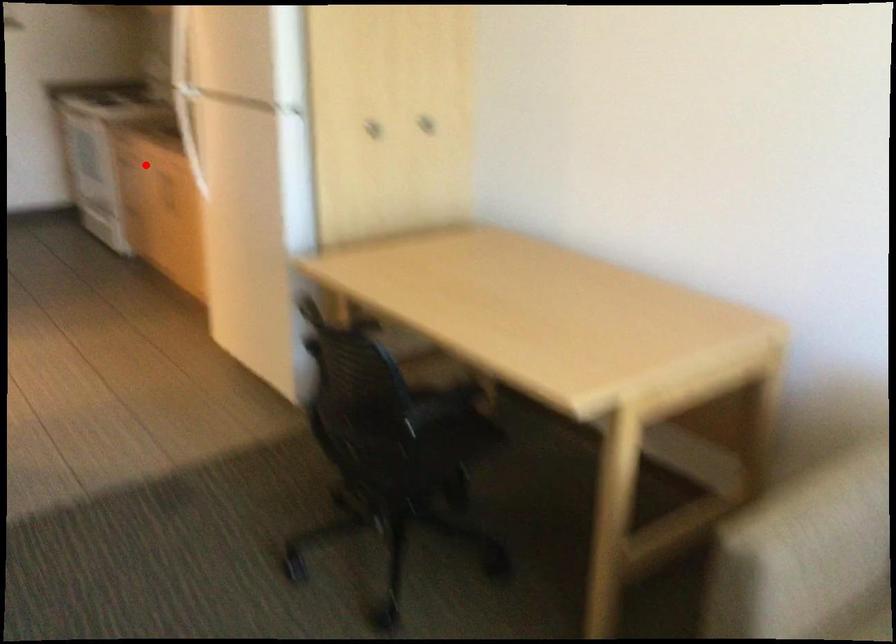
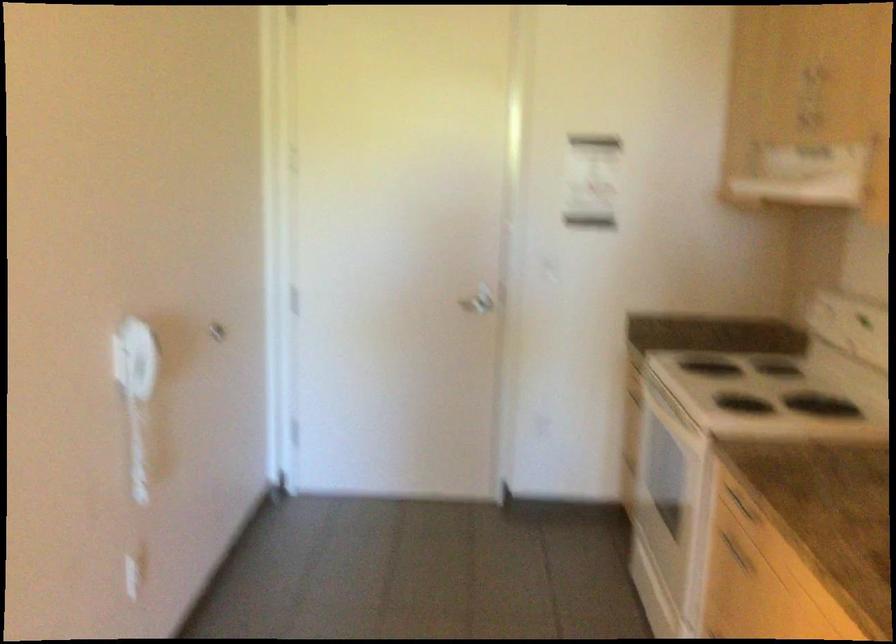
Question: I am providing you with two images of the same scene from different viewpoints. In image1, a red point is highlighted. Considering the same 3D point in image2, which of the following is correct?

Choices:
 (A) It is closer
 (B) It is farther

Answer: (A)